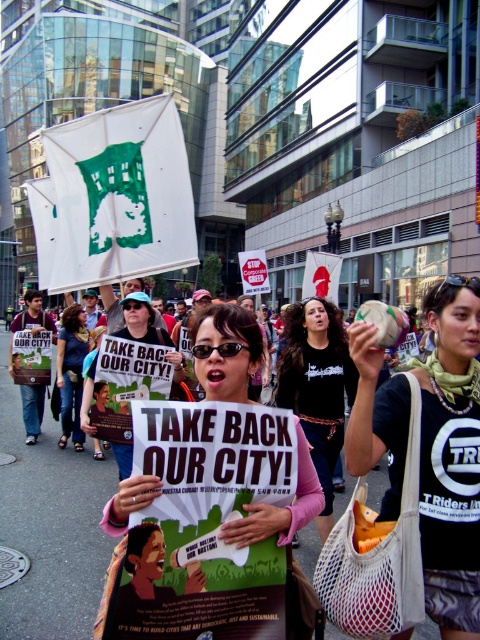
You are a photographer standing at the edge of the protest crowd. You want to take a photo of the black mesh bag at center and the pink fabric shirt at center without any obstruction. Given that your camera has a maximum focus range of 36 inches, can you capture both objects clearly in the same frame?

The distance between the black mesh bag at center and the pink fabric shirt at center is 36.81 inches, which exceeds the camera maximum focus range of 36 inches. Therefore, you cannot capture both objects clearly in the same frame.

You are a photographer at the protest scene. You want to take a photo of the black mesh bag at center and the black cotton shirt at center. Which object should you focus on first if you need to capture both in a single frame without moving the camera?

The black cotton shirt at center should be focused on first because the black mesh bag at center is to the right of it, so adjusting focus from the shirt to the bag would keep both in frame without needing to move the camera.

You are a photographer trying to capture a photo of the protest. You notice the matte black sign at center and the pink fabric shirt at center. Which object should you zoom in on to ensure both are clearly visible in the frame?

You should zoom in on the pink fabric shirt at center because its smaller size compared to the matte black sign at center will allow both objects to fit within the frame while maintaining clarity.